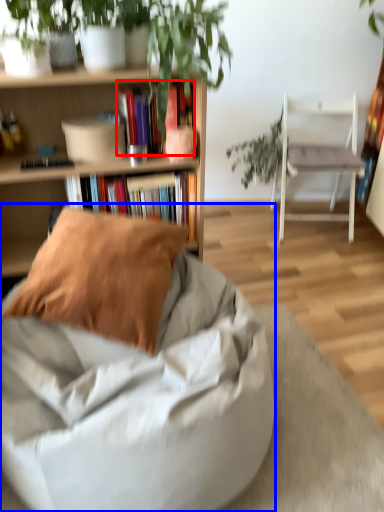
Question: Which object appears farthest to the camera in this image, book (highlighted by a red box) or chair (highlighted by a blue box)?

Choices:
 (A) book
 (B) chair

Answer: (A)